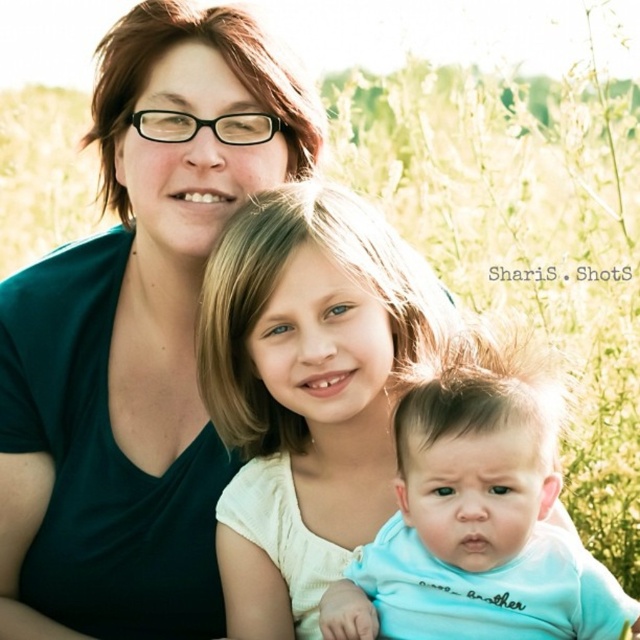
Question: Which object is farther from the camera taking this photo?

Choices:
 (A) smooth cream shirt at center
 (B) light blue fabric baby at center

Answer: (A)

Question: Which point is farther to the camera?

Choices:
 (A) smooth cream shirt at center
 (B) light blue fabric baby at center

Answer: (A)

Question: Can you confirm if smooth cream shirt at center is bigger than light blue fabric baby at center?

Choices:
 (A) yes
 (B) no

Answer: (A)

Question: Is smooth cream shirt at center positioned behind light blue fabric baby at center?

Choices:
 (A) no
 (B) yes

Answer: (B)

Question: Can you confirm if smooth cream shirt at center is wider than light blue fabric baby at center?

Choices:
 (A) no
 (B) yes

Answer: (B)